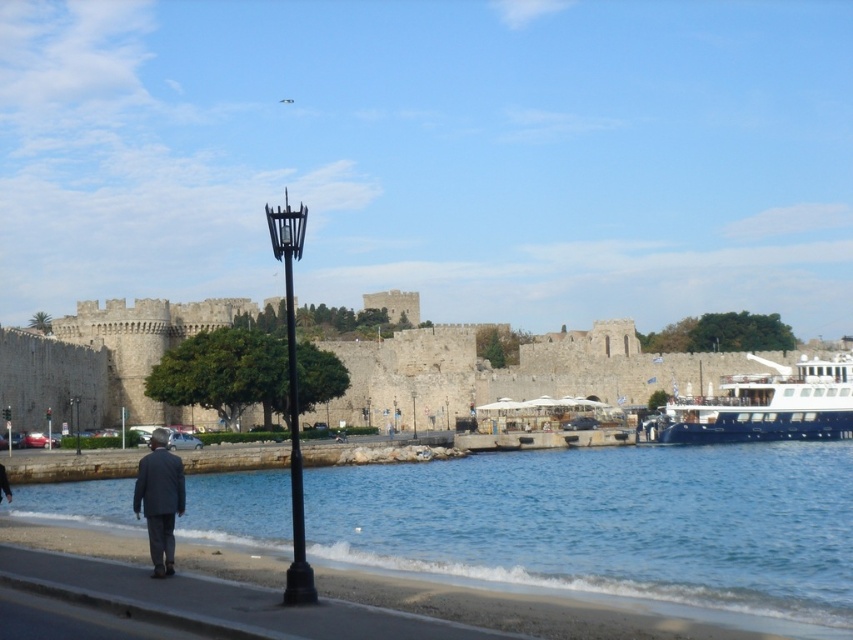
Question: Which point is closer to the camera taking this photo?

Choices:
 (A) (534, 541)
 (B) (799, 380)

Answer: (A)

Question: Is dark gray suit at lower left further to the viewer compared to black metal lamp post at lower center?

Choices:
 (A) yes
 (B) no

Answer: (B)

Question: Can you confirm if blue water at lower center is thinner than blue glossy yacht at right?

Choices:
 (A) no
 (B) yes

Answer: (A)

Question: Which point appears closest to the camera in this image?

Choices:
 (A) (79, 401)
 (B) (297, 420)

Answer: (A)

Question: Can you confirm if blue water at lower center is bigger than blue glossy yacht at right?

Choices:
 (A) yes
 (B) no

Answer: (B)

Question: Which of the following is the closest to the observer?

Choices:
 (A) (70, 410)
 (B) (656, 438)
 (C) (146, 461)
 (D) (302, 513)

Answer: (C)